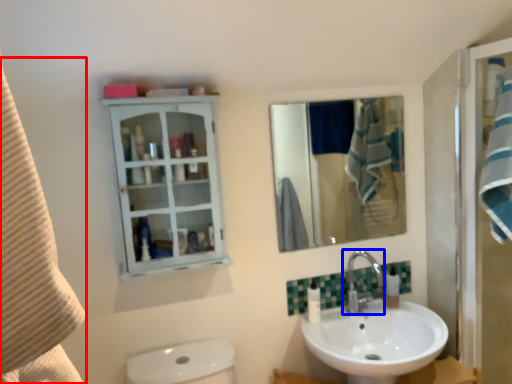
Question: Which object is further to the camera taking this photo, beach towel (highlighted by a red box) or tap (highlighted by a blue box)?

Choices:
 (A) beach towel
 (B) tap

Answer: (B)